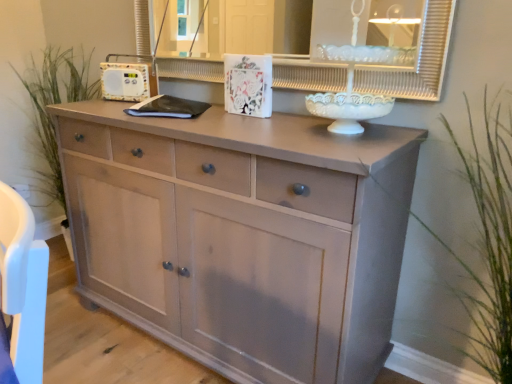
Question: Is matte light wood chest of drawers at center positioned far away from green grass at left, positioned as the 1th plant in back-to-front order?

Choices:
 (A) no
 (B) yes

Answer: (B)

Question: Is matte light wood chest of drawers at center taller than green grass at left, the first plant in the left-to-right sequence?

Choices:
 (A) yes
 (B) no

Answer: (B)

Question: Can you confirm if matte light wood chest of drawers at center is bigger than green grass at left, positioned as the 1th plant in back-to-front order?

Choices:
 (A) no
 (B) yes

Answer: (B)

Question: Is matte light wood chest of drawers at center thinner than green grass at left, placed as the second plant when sorted from front to back?

Choices:
 (A) yes
 (B) no

Answer: (B)

Question: Does matte light wood chest of drawers at center lie in front of green grass at left, the first plant in the left-to-right sequence?

Choices:
 (A) no
 (B) yes

Answer: (B)

Question: Looking at their shapes, would you say white glossy medicine cabinet at upper center is wider or thinner than matte light wood chest of drawers at center?

Choices:
 (A) thin
 (B) wide

Answer: (A)

Question: Is point (287, 77) positioned closer to the camera than point (91, 152)?

Choices:
 (A) farther
 (B) closer

Answer: (B)

Question: From a real-world perspective, is white glossy medicine cabinet at upper center above or below matte light wood chest of drawers at center?

Choices:
 (A) below
 (B) above

Answer: (B)

Question: Choose the correct answer: Is white glossy medicine cabinet at upper center inside matte light wood chest of drawers at center or outside it?

Choices:
 (A) inside
 (B) outside

Answer: (B)

Question: Is point (364, 72) closer or farther from the camera than point (82, 92)?

Choices:
 (A) farther
 (B) closer

Answer: (B)

Question: Would you say white glossy medicine cabinet at upper center is to the left or to the right of green grass at left, the first plant in the left-to-right sequence, in the picture?

Choices:
 (A) right
 (B) left

Answer: (A)

Question: Is white glossy medicine cabinet at upper center wider or thinner than green grass at left, the second plant when ordered from right to left?

Choices:
 (A) thin
 (B) wide

Answer: (A)

Question: Relative to green grass at left, placed as the second plant when sorted from front to back, is white glossy medicine cabinet at upper center in front or behind?

Choices:
 (A) front
 (B) behind

Answer: (A)

Question: Is green grass at right, positioned as the second plant in left-to-right order, spatially inside white glossy medicine cabinet at upper center, or outside of it?

Choices:
 (A) inside
 (B) outside

Answer: (B)

Question: Considering the positions of point (497, 183) and point (165, 61), is point (497, 183) closer or farther from the camera than point (165, 61)?

Choices:
 (A) closer
 (B) farther

Answer: (A)